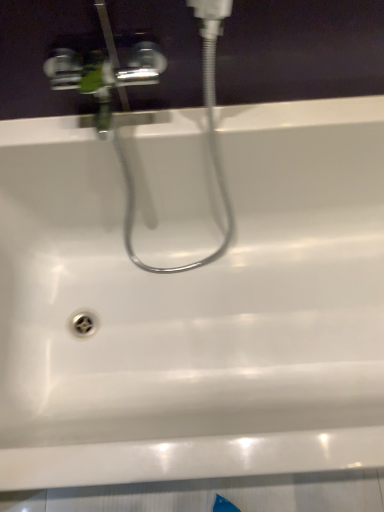
The width and height of the screenshot is (384, 512). I want to click on white glossy sink at upper center, so click(103, 65).

Describe the element at coordinates (103, 65) in the screenshot. This screenshot has height=512, width=384. I see `white glossy sink at upper center` at that location.

What is the approximate height of white glossy sink at upper center?

32.05 inches.

At what (x,y) coordinates should I click in order to perform the action: click on white glossy sink at upper center. Please return your answer as a coordinate pair (x, y). Looking at the image, I should click on (103, 65).